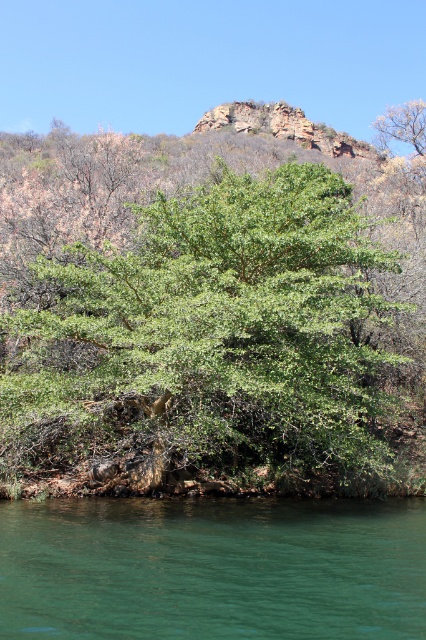
Does green leafy tree at center appear on the right side of green smooth water at lower center?

Correct, you'll find green leafy tree at center to the right of green smooth water at lower center.

What do you see at coordinates (207, 349) in the screenshot? I see `green leafy tree at center` at bounding box center [207, 349].

Image resolution: width=426 pixels, height=640 pixels. What do you see at coordinates (207, 349) in the screenshot?
I see `green leafy tree at center` at bounding box center [207, 349].

The image size is (426, 640). I want to click on green leafy tree at center, so click(x=207, y=349).